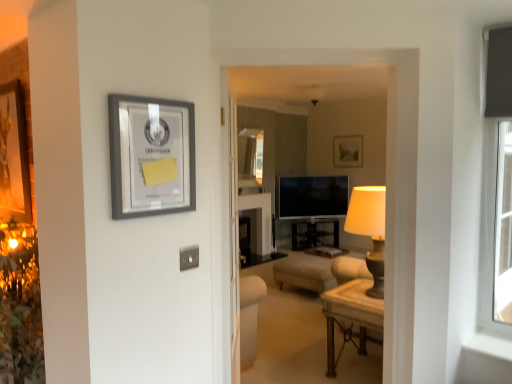
Question: Does point (143, 162) appear closer or farther from the camera than point (356, 289)?

Choices:
 (A) farther
 (B) closer

Answer: (B)

Question: Looking at the image, does matte gray picture frame at upper left seem bigger or smaller compared to wooden polished table at center?

Choices:
 (A) big
 (B) small

Answer: (B)

Question: Which is farther from the matte gray picture frame at upper left?

Choices:
 (A) matte black tv at center
 (B) wooden polished table at center

Answer: (A)

Question: Estimate the real-world distances between objects in this image. Which object is farther from the wooden polished table at center?

Choices:
 (A) matte gray picture frame at upper left
 (B) matte black tv at center

Answer: (B)